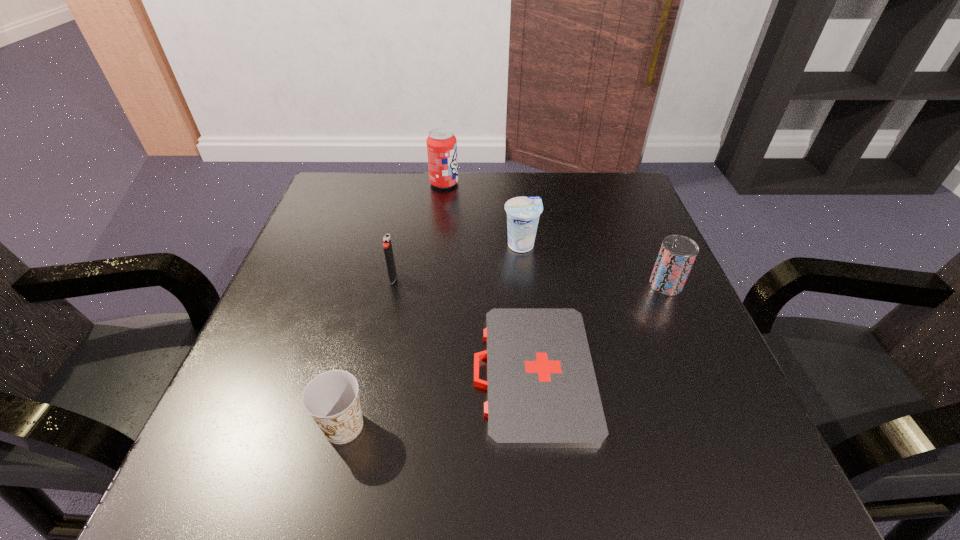
Where is `free point between the igniter and the beer can`? free point between the igniter and the beer can is located at coordinates (530, 281).

Where is `free space between the igniter and the first-aid kit`? free space between the igniter and the first-aid kit is located at coordinates (463, 325).

Identify the location of free space between the Dixie cup and the shortest object. This screenshot has height=540, width=960. (439, 399).

This screenshot has width=960, height=540. What are the coordinates of `blank region between the yogurt and the Dixie cup` in the screenshot? It's located at (432, 335).

I want to click on vacant region between the Dixie cup and the tallest object, so click(394, 305).

Find the location of `vacant point located between the igniter and the Dixie cup`. vacant point located between the igniter and the Dixie cup is located at coordinates (369, 352).

Identify the location of the third closest object to the yogurt. (677, 254).

Identify the location of object that is the fifth closest to the igniter. (677, 254).

The width and height of the screenshot is (960, 540). Identify the location of free point that satisfies the following two spatial constraints: 1. on the back side of the igniter; 2. on the left side of the Dixie cup. (380, 278).

Where is `vacant space that satisfies the following two spatial constraints: 1. on the surface of the rightmost object; 2. on the left side of the soda can`? This screenshot has height=540, width=960. vacant space that satisfies the following two spatial constraints: 1. on the surface of the rightmost object; 2. on the left side of the soda can is located at coordinates (433, 284).